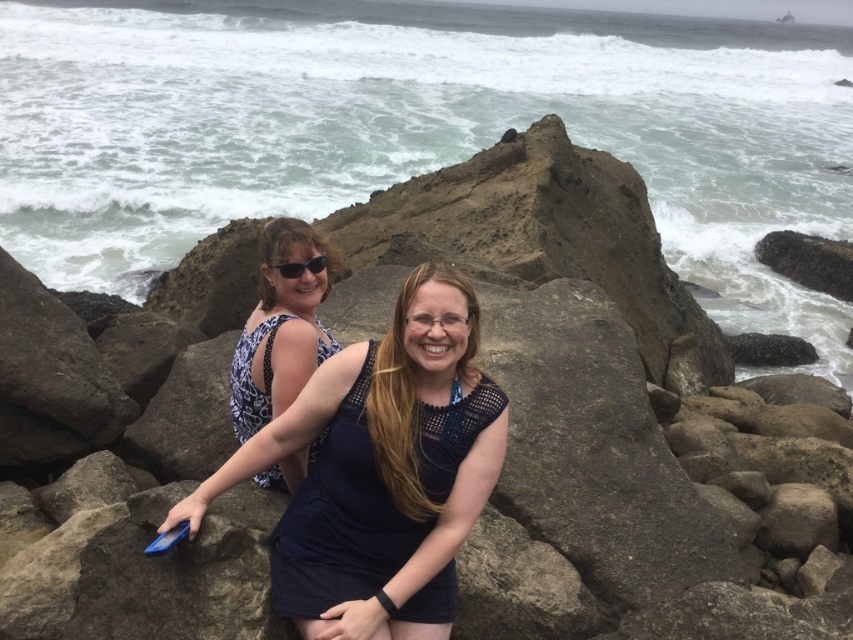
Question: Is blue dotted dress at center wider than black plastic sunglasses at upper center?

Choices:
 (A) yes
 (B) no

Answer: (A)

Question: Which point is closer to the camera taking this photo?

Choices:
 (A) (379, 550)
 (B) (296, 266)

Answer: (A)

Question: Among these points, which one is nearest to the camera?

Choices:
 (A) (326, 264)
 (B) (247, 433)

Answer: (B)

Question: Is dark blue fabric dress at center further to the viewer compared to blue dotted dress at center?

Choices:
 (A) yes
 (B) no

Answer: (B)

Question: Is blue dotted dress at center below black plastic sunglasses at upper center?

Choices:
 (A) no
 (B) yes

Answer: (B)

Question: Among these points, which one is farthest from the camera?

Choices:
 (A) (389, 384)
 (B) (326, 332)

Answer: (B)